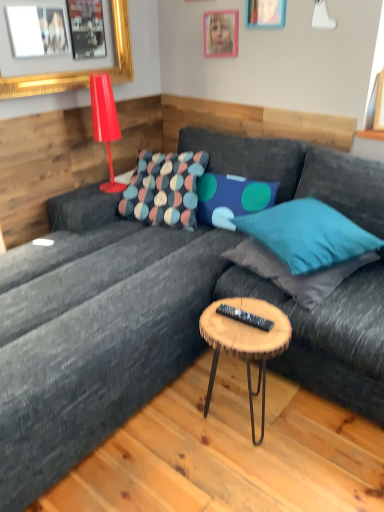
Question: Does teal fabric pillow at upper right, the third pillow positioned from the left, turn towards shiny red lamp at upper left?

Choices:
 (A) yes
 (B) no

Answer: (B)

Question: Are teal fabric pillow at upper right, the third pillow positioned from the left, and shiny red lamp at upper left far apart?

Choices:
 (A) no
 (B) yes

Answer: (B)

Question: From a real-world perspective, is teal fabric pillow at upper right, the third pillow positioned from the left, under shiny red lamp at upper left?

Choices:
 (A) yes
 (B) no

Answer: (A)

Question: From the image's perspective, does teal fabric pillow at upper right, the 2th pillow in the right-to-left sequence, appear lower than shiny red lamp at upper left?

Choices:
 (A) no
 (B) yes

Answer: (B)

Question: Considering the relative sizes of teal fabric pillow at upper right, the 2th pillow in the right-to-left sequence, and shiny red lamp at upper left in the image provided, is teal fabric pillow at upper right, the 2th pillow in the right-to-left sequence, bigger than shiny red lamp at upper left?

Choices:
 (A) yes
 (B) no

Answer: (A)

Question: Do you think woodenmaterial/texturecoffee table at center is within blue fabric pillow at center, which is counted as the 2th pillow, starting from the left, or outside of it?

Choices:
 (A) inside
 (B) outside

Answer: (B)

Question: In terms of size, does woodenmaterial/texturecoffee table at center appear bigger or smaller than blue fabric pillow at center, which is counted as the 3th pillow, starting from the right?

Choices:
 (A) big
 (B) small

Answer: (A)

Question: From a real-world perspective, is woodenmaterial/texturecoffee table at center positioned above or below blue fabric pillow at center, which is counted as the 2th pillow, starting from the left?

Choices:
 (A) below
 (B) above

Answer: (A)

Question: In the image, is woodenmaterial/texturecoffee table at center positioned in front of or behind blue fabric pillow at center, which is counted as the 2th pillow, starting from the left?

Choices:
 (A) front
 (B) behind

Answer: (A)

Question: From the image's perspective, is teal fabric pillow at right, the 4th pillow when ordered from left to right, above or below blue fabric pillow at center, which is counted as the 2th pillow, starting from the left?

Choices:
 (A) below
 (B) above

Answer: (A)

Question: Would you say teal fabric pillow at right, the 4th pillow when ordered from left to right, is inside or outside blue fabric pillow at center, which is counted as the 2th pillow, starting from the left?

Choices:
 (A) inside
 (B) outside

Answer: (B)

Question: Considering the positions of teal fabric pillow at right, placed as the 1th pillow when sorted from right to left, and blue fabric pillow at center, which is counted as the 3th pillow, starting from the right, in the image, is teal fabric pillow at right, placed as the 1th pillow when sorted from right to left, bigger or smaller than blue fabric pillow at center, which is counted as the 3th pillow, starting from the right,?

Choices:
 (A) small
 (B) big

Answer: (B)

Question: Is point (306, 302) closer or farther from the camera than point (226, 217)?

Choices:
 (A) closer
 (B) farther

Answer: (A)

Question: Based on their positions, is black plastic remote at center located to the left or right of pink plastic picture frame at upper center, the 2th picture frame from the right?

Choices:
 (A) left
 (B) right

Answer: (B)

Question: Is black plastic remote at center taller or shorter than pink plastic picture frame at upper center, marked as the second picture frame in a left-to-right arrangement?

Choices:
 (A) tall
 (B) short

Answer: (B)